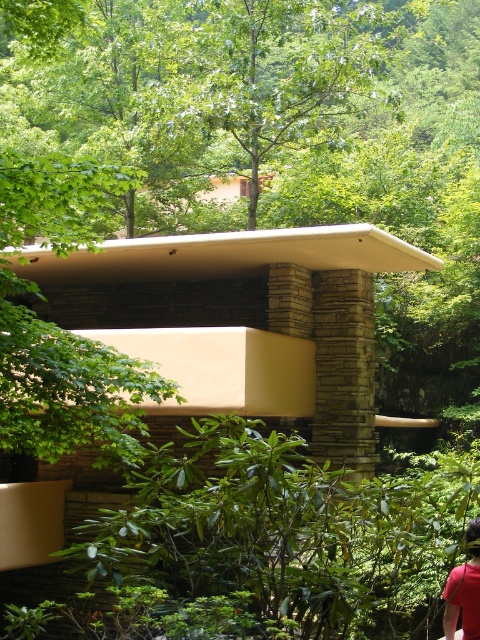
You are a hiker who has just arrived at the beige stone shelter at center and wants to check the location of your friend wearing the red shirt at lower right. Based on the scene, where should you look relative to the shelter?

The beige stone shelter at center is to the left of the red shirt at lower right, so you should look to the right side of the shelter to find your friend wearing the red shirt at lower right.

You are standing at the entrance of the modern architectural structure and want to locate two specific points marked in the image. The first point is at coordinates point (292, 394) and the second is at point (464, 570). Which point is closer to you when you are facing the building?

Point (464, 570) is closer to you because it is in front of point (292, 394) according to the spatial arrangement described.